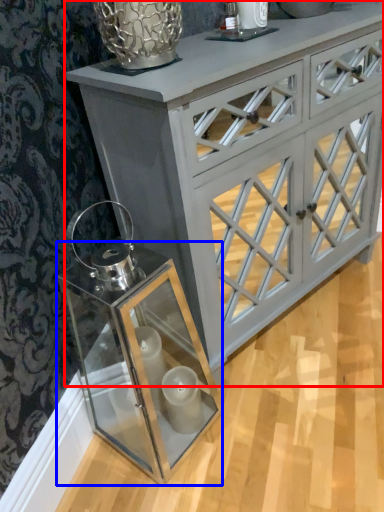
Question: Among these objects, which one is nearest to the camera, chest of drawers (highlighted by a red box) or glass box (highlighted by a blue box)?

Choices:
 (A) chest of drawers
 (B) glass box

Answer: (B)